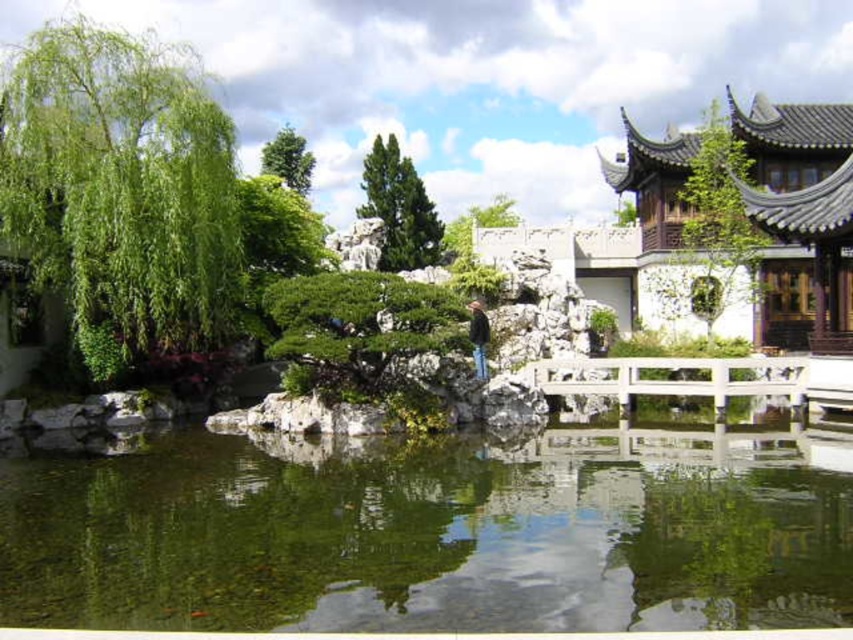
You are standing at the entrance of the garden and see the green matte tree at upper right and the green leafy tree at center. Which tree is positioned more to the right side of the garden?

The green matte tree at upper right is positioned to the right of the green leafy tree at center, so it is more to the right side of the garden.

You are a visitor in the garden and want to see the reflection of the green textured tree at center in the clear water at center. Is the tree reflected in the water?

The clear water at center is positioned under green textured tree at center, so the tree is reflected in the water.